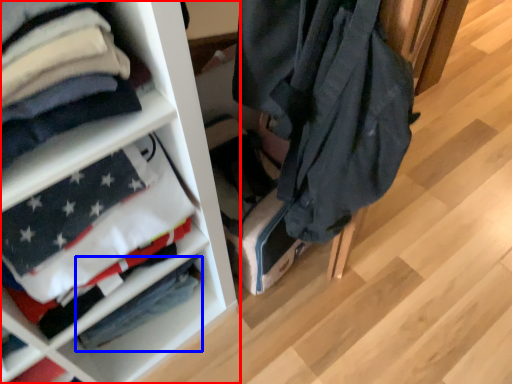
Question: Which point is further to the camera, shelf (highlighted by a red box) or flag (highlighted by a blue box)?

Choices:
 (A) shelf
 (B) flag

Answer: (B)